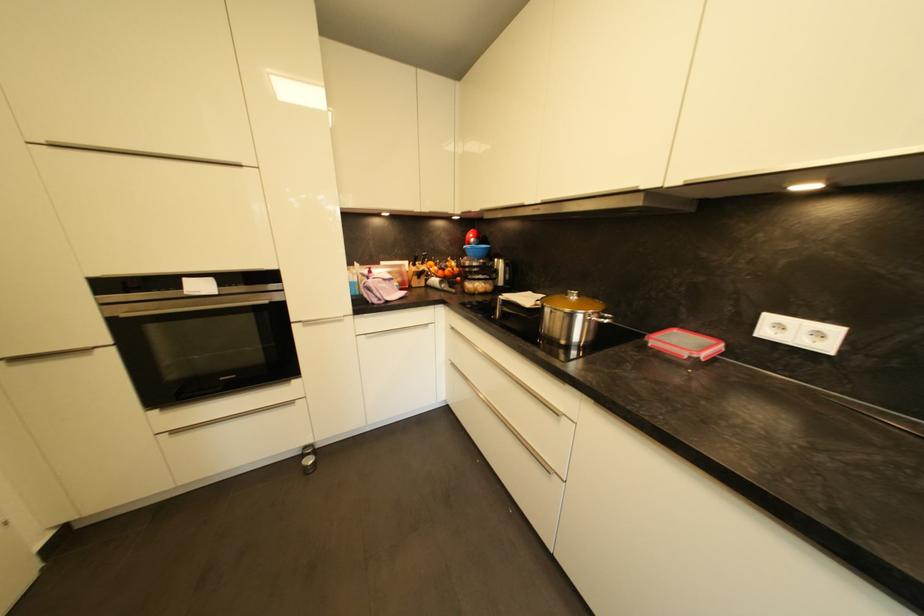
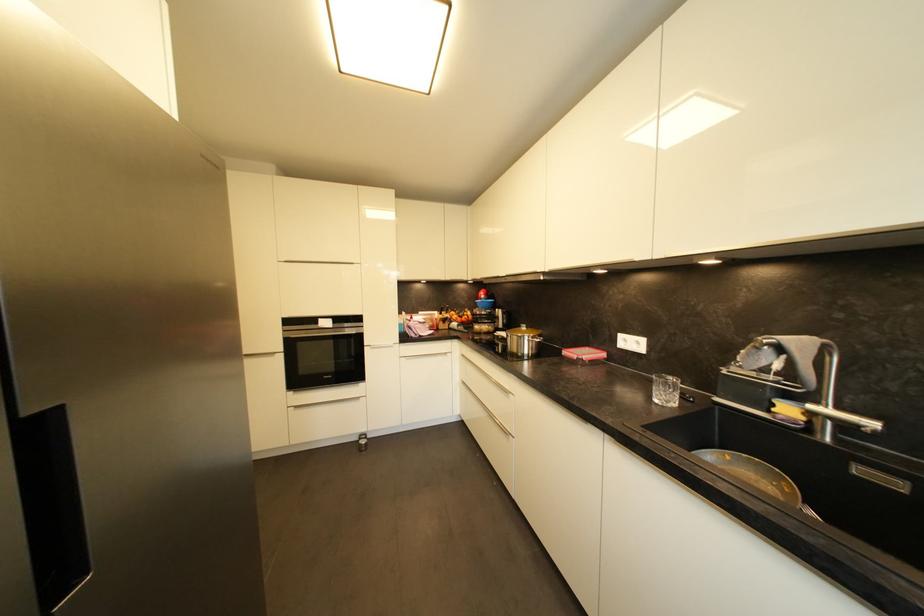
Find the pixel in the second image that matches (x=824, y=336) in the first image.

(642, 345)